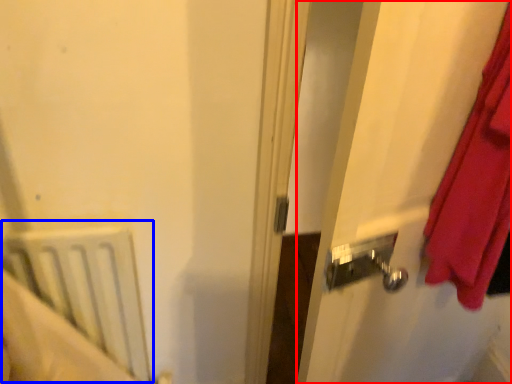
Question: Which of the following is the farthest to the observer, screen door (highlighted by a red box) or radiator (highlighted by a blue box)?

Choices:
 (A) screen door
 (B) radiator

Answer: (B)